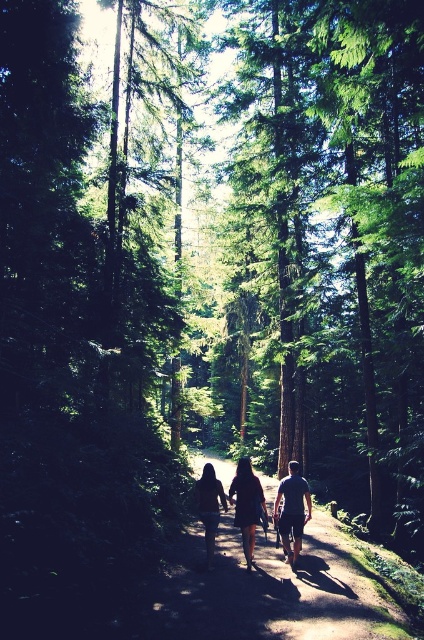
Question: Among these points, which one is farthest from the camera?

Choices:
 (A) (289, 492)
 (B) (247, 561)
 (C) (306, 484)
 (D) (222, 490)

Answer: (C)

Question: Is dark brown leather backpack at center smaller than black matte dress at center?

Choices:
 (A) yes
 (B) no

Answer: (B)

Question: Based on their relative distances, which object is nearer to the black matte dress at center?

Choices:
 (A) dark brown leather jacket at center
 (B) dark blue t-shirt at center

Answer: (A)

Question: Is dark brown leather backpack at center closer to the viewer compared to black matte dress at center?

Choices:
 (A) yes
 (B) no

Answer: (B)

Question: Is dark brown leather backpack at center thinner than black matte dress at center?

Choices:
 (A) no
 (B) yes

Answer: (A)

Question: Which of the following is the farthest from the observer?

Choices:
 (A) (276, 506)
 (B) (214, 524)
 (C) (242, 481)

Answer: (A)